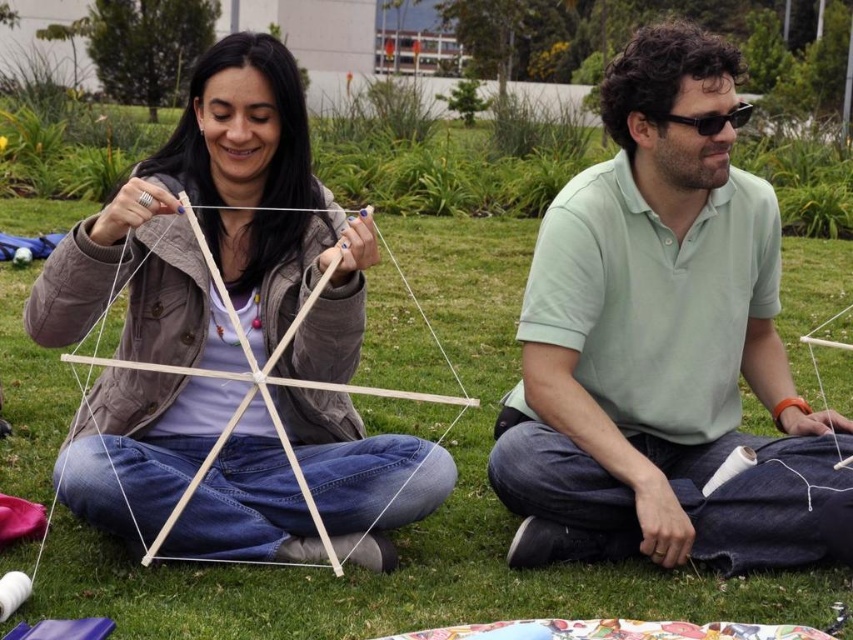
Based on the scene description, where is the white matte string at center located in the image?

The white matte string at center is located at point (259,392).

You are a fashion designer analyzing the image. You need to decide which item is wider between the light green cotton shirt at center and the black plastic goggles at upper right. Which one is wider?

The light green cotton shirt at center is wider than the black plastic goggles at upper right.